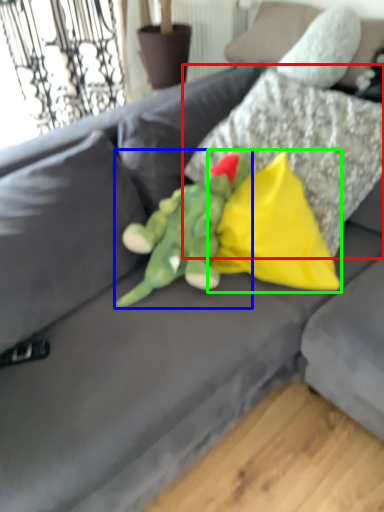
Question: Considering the real-world distances, which object is farthest from pillow (highlighted by a red box)? toy (highlighted by a blue box) or pillow (highlighted by a green box)?

Choices:
 (A) toy
 (B) pillow

Answer: (A)